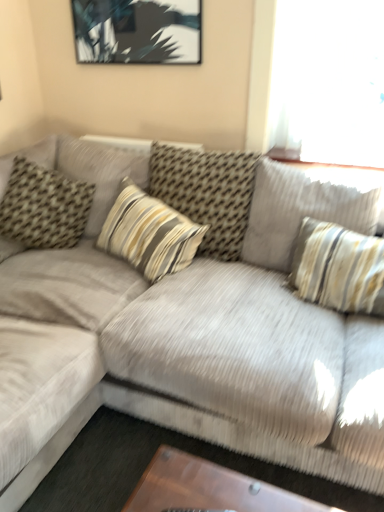
Question: Which direction should I rotate to look at striped fabric pillow at center, the second pillow in the right-to-left sequence, — up or down?

Choices:
 (A) down
 (B) up

Answer: (B)

Question: Considering the relative sizes of striped fabric pillow at upper right, the fourth pillow from the left, and striped fabric pillow at center, acting as the 3th pillow starting from the right, in the image provided, is striped fabric pillow at upper right, the fourth pillow from the left, shorter than striped fabric pillow at center, acting as the 3th pillow starting from the right,?

Choices:
 (A) yes
 (B) no

Answer: (B)

Question: Considering the relative sizes of striped fabric pillow at upper right, the first pillow in the right-to-left sequence, and striped fabric pillow at center, acting as the 3th pillow starting from the right, in the image provided, is striped fabric pillow at upper right, the first pillow in the right-to-left sequence, bigger than striped fabric pillow at center, acting as the 3th pillow starting from the right,?

Choices:
 (A) yes
 (B) no

Answer: (A)

Question: Is striped fabric pillow at upper right, the fourth pillow from the left, thinner than striped fabric pillow at center, which ranks as the second pillow in left-to-right order?

Choices:
 (A) yes
 (B) no

Answer: (A)

Question: Is striped fabric pillow at upper right, the fourth pillow from the left, outside of striped fabric pillow at center, acting as the 3th pillow starting from the right?

Choices:
 (A) yes
 (B) no

Answer: (A)

Question: Is striped fabric pillow at upper right, the fourth pillow from the left, taller than striped fabric pillow at center, which ranks as the second pillow in left-to-right order?

Choices:
 (A) no
 (B) yes

Answer: (B)

Question: From the image's perspective, is striped fabric pillow at upper right, the fourth pillow from the left, on top of striped fabric pillow at center, acting as the 3th pillow starting from the right?

Choices:
 (A) no
 (B) yes

Answer: (B)

Question: Is velvet beige couch at center facing away from striped fabric pillow at center, which ranks as the second pillow in left-to-right order?

Choices:
 (A) yes
 (B) no

Answer: (A)

Question: Is velvet beige couch at center at the right side of striped fabric pillow at center, acting as the 3th pillow starting from the right?

Choices:
 (A) yes
 (B) no

Answer: (B)

Question: Considering the relative positions of velvet beige couch at center and striped fabric pillow at center, which ranks as the second pillow in left-to-right order, in the image provided, is velvet beige couch at center behind striped fabric pillow at center, which ranks as the second pillow in left-to-right order,?

Choices:
 (A) no
 (B) yes

Answer: (A)

Question: Is velvet beige couch at center in front of striped fabric pillow at center, acting as the 3th pillow starting from the right?

Choices:
 (A) yes
 (B) no

Answer: (A)

Question: From the image's perspective, is velvet beige couch at center on striped fabric pillow at center, which ranks as the second pillow in left-to-right order?

Choices:
 (A) yes
 (B) no

Answer: (B)

Question: From a real-world perspective, is velvet beige couch at center on striped fabric pillow at center, acting as the 3th pillow starting from the right?

Choices:
 (A) no
 (B) yes

Answer: (A)

Question: Could you tell me if brown textured pillow at left, the 1th pillow from the left, is facing striped fabric pillow at center, acting as the 3th pillow starting from the right?

Choices:
 (A) no
 (B) yes

Answer: (A)